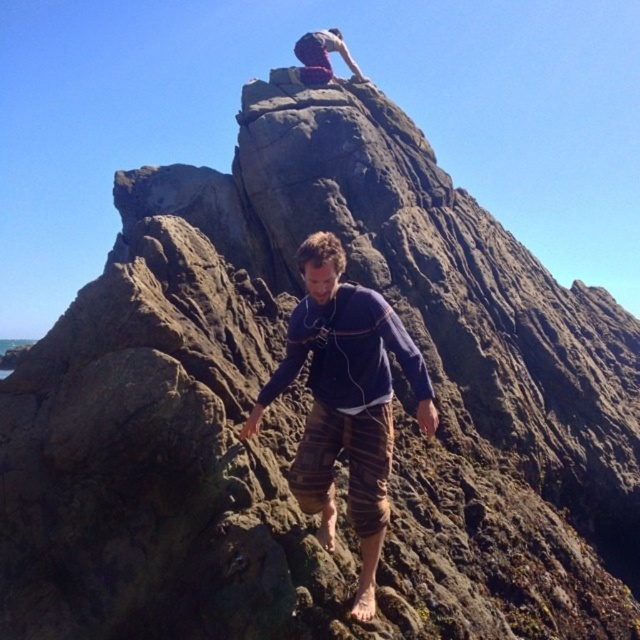
You are a photographer planning to take a picture of the striped cotton shorts at center. The camera you are using has a focus point set at coordinate point (346, 401). Will the striped cotton shorts at center be in focus?

Yes, the focus point at (346, 401) is exactly where the striped cotton shorts at center are located, so they will be in focus.

You are a photographer trying to capture the climber in the image. You notice the striped cotton shorts at center and the red fabric pants at upper center. Which piece of clothing is located to the left of the other?

The striped cotton shorts at center is positioned on the left side of red fabric pants at upper center.